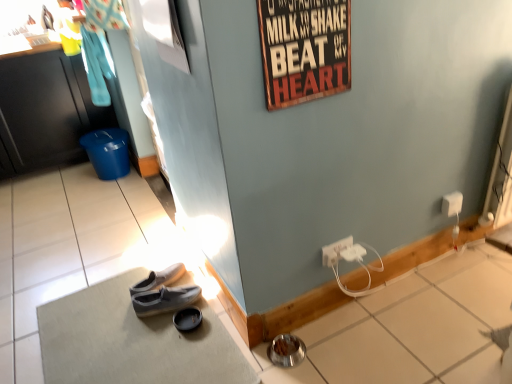
At what (x,y) coordinates should I click in order to perform the action: click on blank space above white glossy tile at lower right (from a real-world perspective). Please return your answer as a coordinate pair (x, y). Looking at the image, I should click on (390, 252).